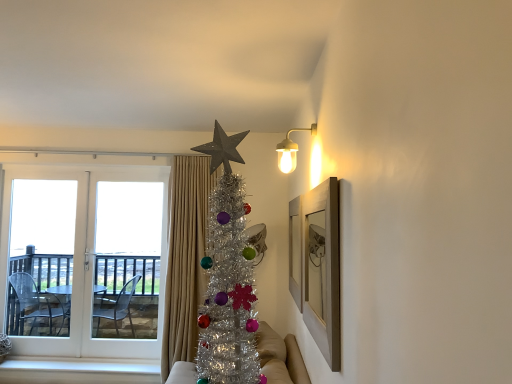
This screenshot has width=512, height=384. I want to click on free point above transparent plastic screen door at left, placed as the first screen door when sorted from left to right (from a real-world perspective), so click(x=42, y=172).